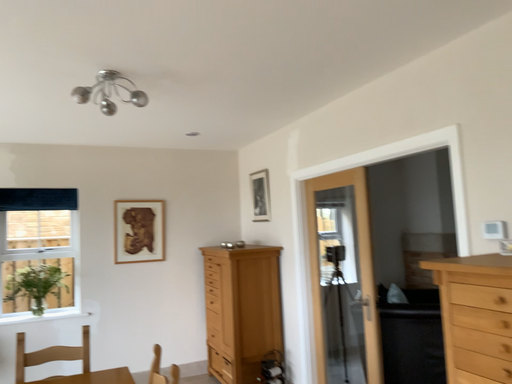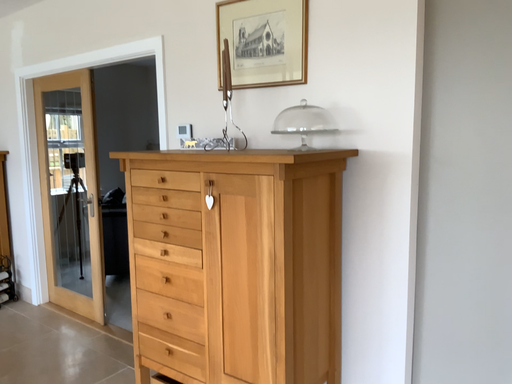
Question: How did the camera likely rotate when shooting the video?

Choices:
 (A) rotated upward
 (B) rotated downward

Answer: (B)